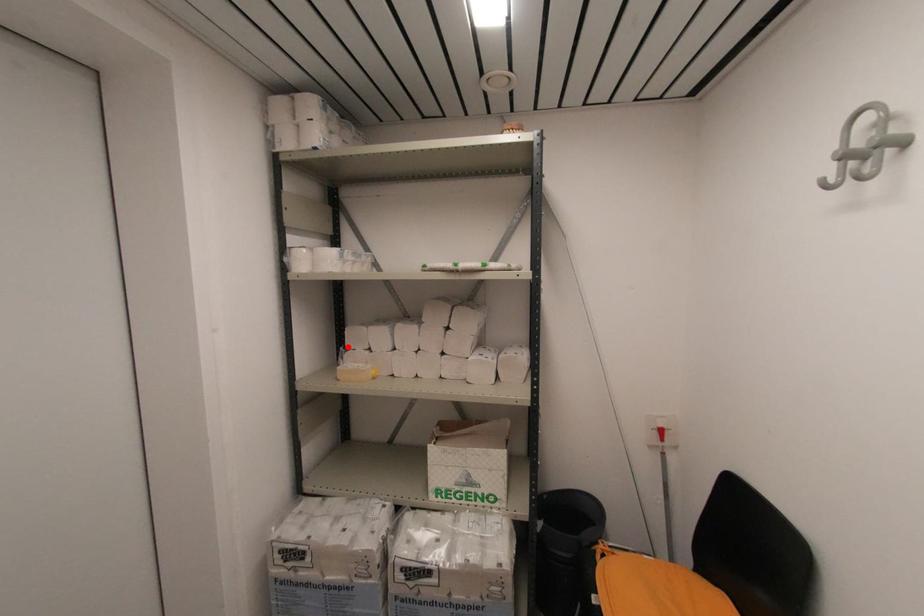
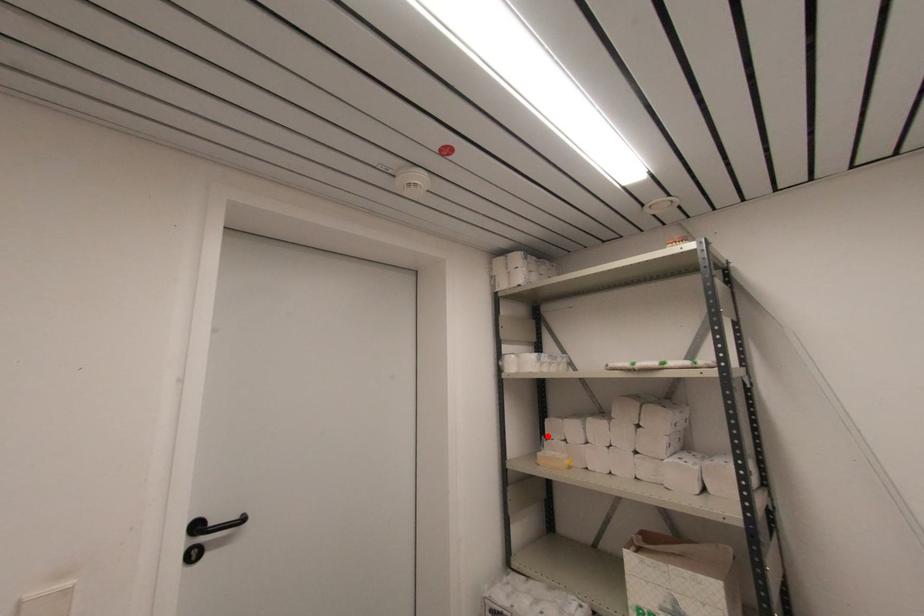
I am providing you with two images of the same scene from different viewpoints. A red point is marked on the first image and another point is marked on the second image. Are the points marked in image1 and image2 representing the same 3D position?

Yes